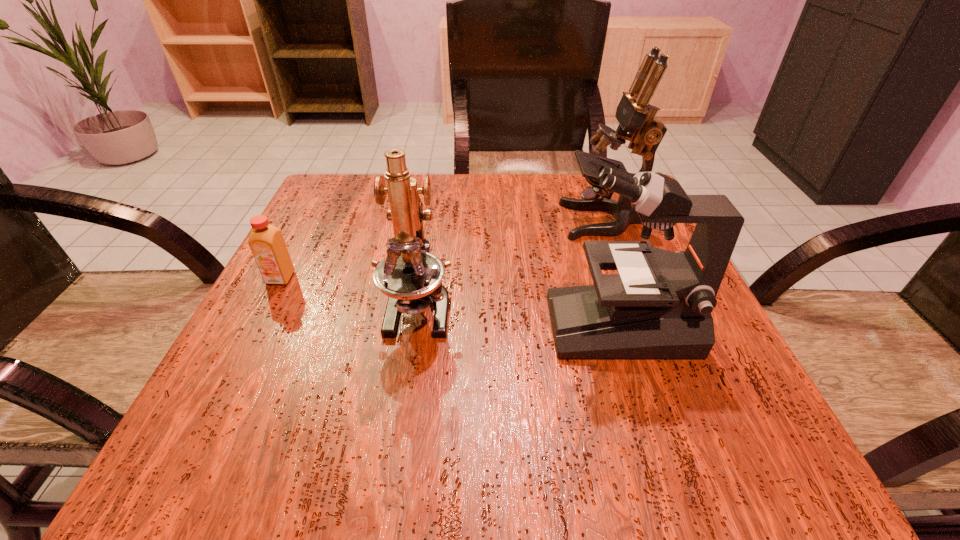
Where is `vacant space that's between the orange juice and the leftmost microscope`? This screenshot has height=540, width=960. vacant space that's between the orange juice and the leftmost microscope is located at coordinates (349, 293).

Where is `free space between the farthest object and the third object from right to left`? Image resolution: width=960 pixels, height=540 pixels. free space between the farthest object and the third object from right to left is located at coordinates (512, 264).

Choose which object is the nearest neighbor to the farthest microscope. Please provide its 2D coordinates. Your answer should be formatted as a tuple, i.e. [(x, y)], where the tuple contains the x and y coordinates of a point satisfying the conditions above.

[(659, 306)]

This screenshot has width=960, height=540. I want to click on object that is the second nearest to the second object from left to right, so click(x=266, y=242).

The width and height of the screenshot is (960, 540). Find the location of `microscope object that ranks as the closest to the farthest microscope`. microscope object that ranks as the closest to the farthest microscope is located at coordinates (659, 306).

Locate an element on the screen. Image resolution: width=960 pixels, height=540 pixels. the closest microscope to the leftmost microscope is located at coordinates (659, 306).

Where is `vacant space that satisfies the following two spatial constraints: 1. at the eyepieces of the farthest microscope; 2. on the front and back of the orange juice`? The width and height of the screenshot is (960, 540). vacant space that satisfies the following two spatial constraints: 1. at the eyepieces of the farthest microscope; 2. on the front and back of the orange juice is located at coordinates (626, 278).

Locate an element on the screen. Image resolution: width=960 pixels, height=540 pixels. vacant space that satisfies the following two spatial constraints: 1. at the eyepieces of the farthest object; 2. at the eyepiece of the leftmost microscope is located at coordinates (637, 307).